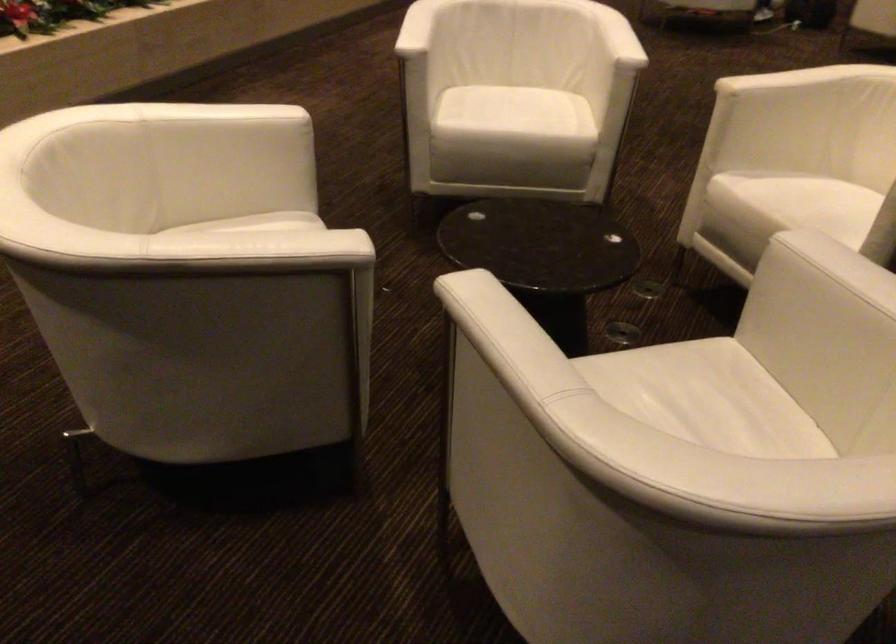
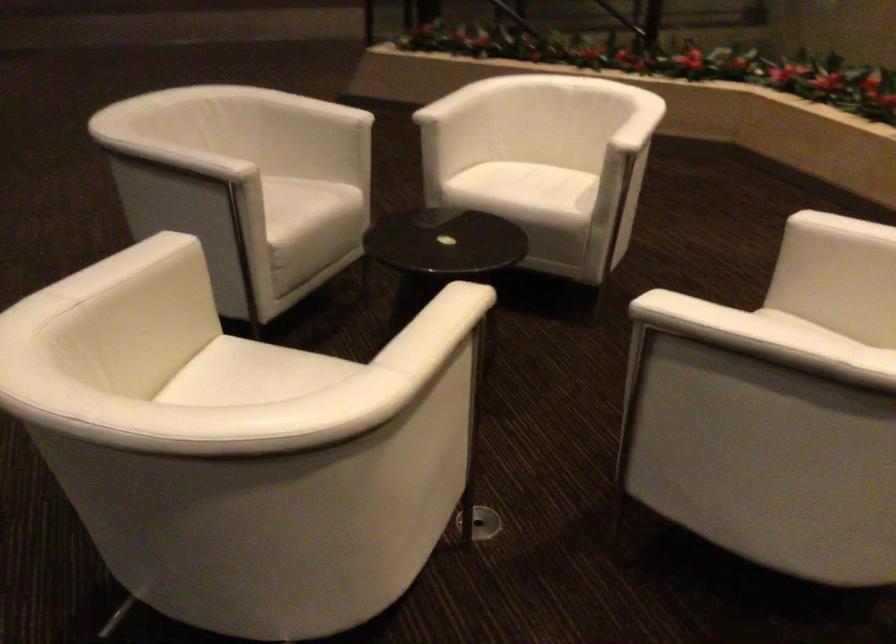
In the second image, find the point that corresponds to the point at 595,366 in the first image.

(306, 205)